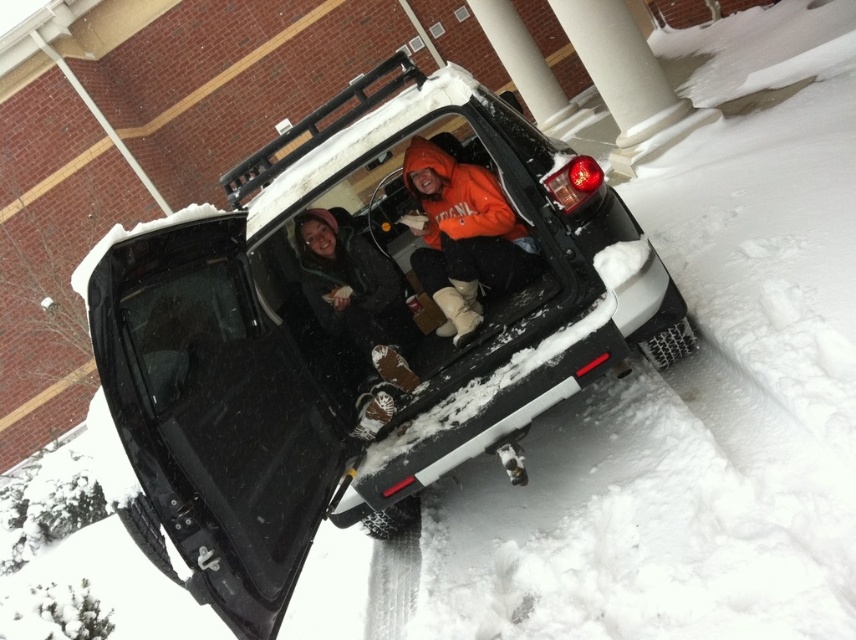
You are a delivery person trying to park a new truck that is exactly the same width as the orange fleece jacket at center in the image. Can you safely park your truck in the same spot as the black matte truck at center without hitting the sides of the truck bed?

The black matte truck at center is wider than the orange fleece jacket at center, so your truck, which matches the jacket in width, can safely park in the same spot without hitting the sides since it is narrower than the existing truck bed.

You are standing 10 feet away from the truck bed in the snowy scene. There is a point located at coordinates point [366,193] within the truck bed. Can you reach that point without moving closer to the truck?

The point at [366,193] is 13.14 feet away from the viewer. Since you are only 10 feet away from the truck bed, you cannot reach the point without moving closer because it is farther than your current distance.